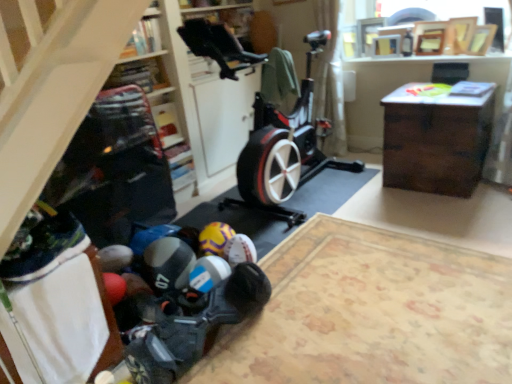
What are the coordinates of `vacant area that is in front of dark wood desk at right` in the screenshot? It's located at (456, 211).